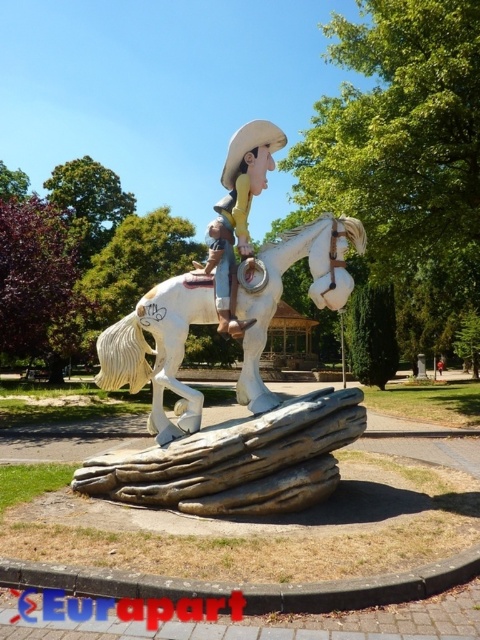
Question: Considering the relative positions of matte yellow cowboy hat at center and smooth beige cowboy hat at center in the image provided, where is matte yellow cowboy hat at center located with respect to smooth beige cowboy hat at center?

Choices:
 (A) below
 (B) above

Answer: (B)

Question: Can you confirm if white glossy horse at center is thinner than smooth beige cowboy hat at center?

Choices:
 (A) yes
 (B) no

Answer: (B)

Question: Considering the real-world distances, which object is closest to the smooth beige cowboy hat at center?

Choices:
 (A) matte yellow cowboy hat at center
 (B) white glossy horse at center

Answer: (A)

Question: Considering the real-world distances, which object is farthest from the white glossy horse at center?

Choices:
 (A) matte yellow cowboy hat at center
 (B) smooth beige cowboy hat at center

Answer: (A)

Question: Based on their relative distances, which object is nearer to the white glossy horse at center?

Choices:
 (A) matte yellow cowboy hat at center
 (B) smooth beige cowboy hat at center

Answer: (B)

Question: Does white glossy horse at center appear on the right side of matte yellow cowboy hat at center?

Choices:
 (A) yes
 (B) no

Answer: (B)